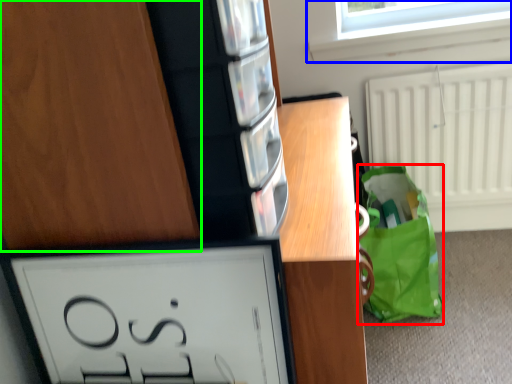
Question: Which object is the farthest from tote bag (highlighted by a red box)? Choose among these: window (highlighted by a blue box) or cabinetry (highlighted by a green box).

Choices:
 (A) window
 (B) cabinetry

Answer: (B)